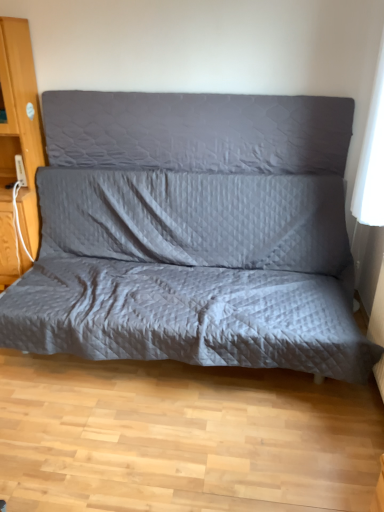
Measure the distance between point (x=212, y=111) and camera.

9.03 feet.

In order to face quilted gray studio couch at center, should I rotate leftwards or rightwards?

Turn left by 1.403 degrees to look at quilted gray studio couch at center.

The image size is (384, 512). Describe the element at coordinates (193, 234) in the screenshot. I see `quilted gray studio couch at center` at that location.

Locate an element on the screen. The height and width of the screenshot is (512, 384). gray quilted pillow at center is located at coordinates (198, 132).

Locate an element on the screen. This screenshot has width=384, height=512. dresser that appears on the left of quilted gray studio couch at center is located at coordinates (18, 142).

Is the depth of wooden dresser at left less than that of quilted gray studio couch at center?

No, wooden dresser at left is further to the viewer.

Is point (11, 115) in front of point (77, 164)?

Yes, point (11, 115) is closer to viewer.

Which of these two, wooden dresser at left or quilted gray studio couch at center, is smaller?

Smaller between the two is wooden dresser at left.

Who is shorter, quilted gray studio couch at center or wooden dresser at left?

quilted gray studio couch at center is shorter.

Is quilted gray studio couch at center located outside wooden dresser at left?

Yes, quilted gray studio couch at center is located beyond the bounds of wooden dresser at left.

Is quilted gray studio couch at center oriented towards wooden dresser at left?

No.

Considering the relative sizes of quilted gray studio couch at center and wooden dresser at left in the image provided, is quilted gray studio couch at center bigger than wooden dresser at left?

Yes.

Would you say quilted gray studio couch at center is part of gray quilted pillow at center's contents?

No.

At what (x,y) coordinates should I click in order to perform the action: click on pillow that is above the quilted gray studio couch at center (from a real-world perspective). Please return your answer as a coordinate pair (x, y). This screenshot has width=384, height=512. Looking at the image, I should click on (198, 132).

In the scene shown: Does gray quilted pillow at center have a greater height compared to quilted gray studio couch at center?

In fact, gray quilted pillow at center may be shorter than quilted gray studio couch at center.

From the image's perspective, which one is positioned higher, wooden dresser at left or gray quilted pillow at center?

gray quilted pillow at center.

Is wooden dresser at left positioned with its back to gray quilted pillow at center?

No.

Is wooden dresser at left touching gray quilted pillow at center?

No, wooden dresser at left is not making contact with gray quilted pillow at center.

What's the angular difference between wooden dresser at left and gray quilted pillow at center's facing directions?

They differ by 0.578 degrees in their facing directions.

Is point (198, 195) behind point (83, 100)?

That is False.

Is quilted gray studio couch at center aimed at gray quilted pillow at center?

No, quilted gray studio couch at center is not turned towards gray quilted pillow at center.

From a real-world perspective, relative to wooden dresser at left, is gray quilted pillow at center vertically above or below?

From a real-world perspective, gray quilted pillow at center is physically above wooden dresser at left.

Does gray quilted pillow at center have a lesser height compared to wooden dresser at left?

Yes.

How far apart are gray quilted pillow at center and wooden dresser at left?

gray quilted pillow at center and wooden dresser at left are 30.21 inches apart from each other.

You are a GUI agent. You are given a task and a screenshot of the screen. Output one action in this format:
    pyautogui.click(x=<x>, y=<y>)
    Task: Click on the dresser in front of the gray quilted pillow at center
    
    Given the screenshot: What is the action you would take?
    pyautogui.click(x=18, y=142)

Find the location of a particular element. Image resolution: width=384 pixels, height=512 pixels. dresser on the left of quilted gray studio couch at center is located at coordinates (18, 142).

At what (x,y) coordinates should I click in order to perform the action: click on dresser behind the quilted gray studio couch at center. Please return your answer as a coordinate pair (x, y). Looking at the image, I should click on (18, 142).

From the image, which object appears to be farther from wooden dresser at left, quilted gray studio couch at center or gray quilted pillow at center?

quilted gray studio couch at center is positioned further to the anchor wooden dresser at left.

When comparing their distances from quilted gray studio couch at center, does wooden dresser at left or gray quilted pillow at center seem further?

wooden dresser at left lies further to quilted gray studio couch at center than the other object.

Considering their positions, is gray quilted pillow at center positioned closer to quilted gray studio couch at center than wooden dresser at left?

gray quilted pillow at center is positioned closer to the anchor quilted gray studio couch at center.

Estimate the real-world distances between objects in this image. Which object is closer to gray quilted pillow at center, quilted gray studio couch at center or wooden dresser at left?

Based on the image, quilted gray studio couch at center appears to be nearer to gray quilted pillow at center.

Considering their positions, is wooden dresser at left positioned further to gray quilted pillow at center than quilted gray studio couch at center?

wooden dresser at left.

Based on their spatial positions, is gray quilted pillow at center or quilted gray studio couch at center further from wooden dresser at left?

Among the two, quilted gray studio couch at center is located further to wooden dresser at left.

Locate an element on the screen. The width and height of the screenshot is (384, 512). studio couch between wooden dresser at left and gray quilted pillow at center in the horizontal direction is located at coordinates (193, 234).